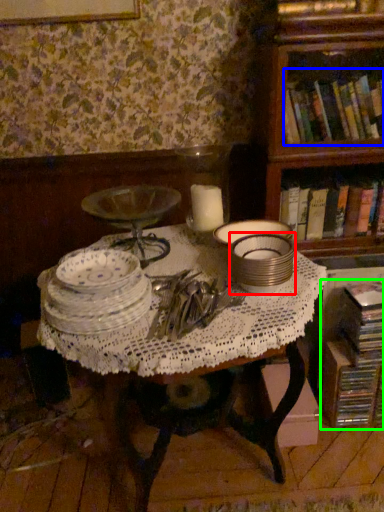
Question: Considering the real-world distances, which object is closest to tableware (highlighted by a red box)? book (highlighted by a blue box) or book (highlighted by a green box).

Choices:
 (A) book
 (B) book

Answer: (B)